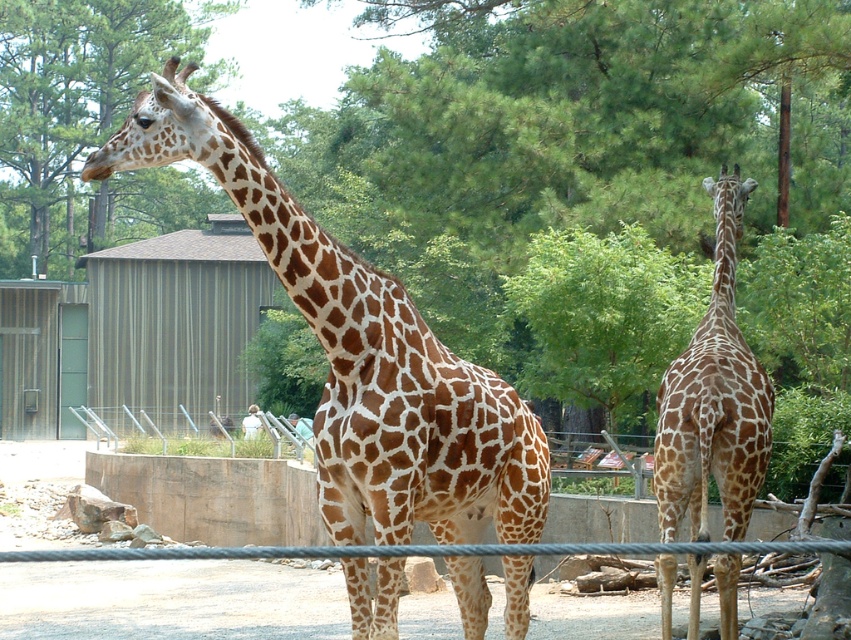
Can you confirm if brown spotted giraffe at left is bigger than smooth white shirt at lower center?

No, brown spotted giraffe at left is not bigger than smooth white shirt at lower center.

Is brown spotted giraffe at left above smooth white shirt at lower center?

Correct, brown spotted giraffe at left is located above smooth white shirt at lower center.

I want to click on brown spotted giraffe at left, so click(360, 355).

Can you confirm if brown spotted giraffe at right is shorter than smooth white shirt at lower center?

In fact, brown spotted giraffe at right may be taller than smooth white shirt at lower center.

Between point (677, 452) and point (254, 422), which one is positioned behind?

The point (254, 422) is behind.

Identify the location of brown spotted giraffe at right. The width and height of the screenshot is (851, 640). (712, 397).

What do you see at coordinates (84, 124) in the screenshot? I see `green leafy tree at upper center` at bounding box center [84, 124].

Does green leafy tree at upper center have a greater height compared to smooth white shirt at lower center?

Correct, green leafy tree at upper center is much taller as smooth white shirt at lower center.

Is point (198, 204) positioned after point (307, 440)?

Yes.

Locate an element on the screen. This screenshot has width=851, height=640. green leafy tree at upper center is located at coordinates (84, 124).